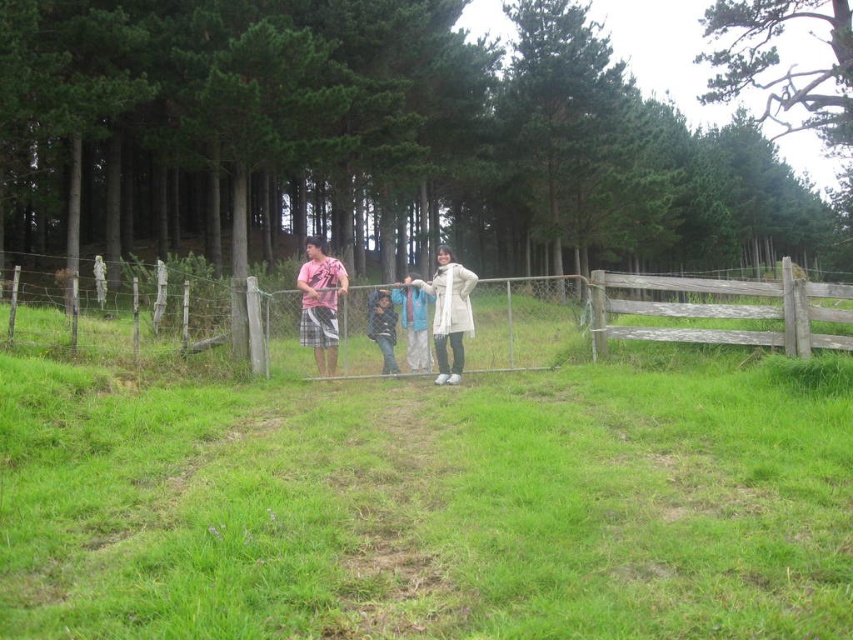
Question: Which of these objects is positioned farthest from the matte pink shirt at center?

Choices:
 (A) weathered wood fence at right
 (B) pink cotton shirt at center

Answer: (A)

Question: Among these objects, which one is farthest from the camera?

Choices:
 (A) pink cotton shirt at center
 (B) weathered wood fence at right
 (C) matte pink shirt at center

Answer: (A)

Question: Does wooden gate at center lie behind matte pink shirt at center?

Choices:
 (A) yes
 (B) no

Answer: (B)

Question: Does wooden gate at center appear on the left side of matte pink shirt at center?

Choices:
 (A) no
 (B) yes

Answer: (B)

Question: Is weathered wood fence at right behind pink cotton shirt at center?

Choices:
 (A) no
 (B) yes

Answer: (A)

Question: Which point is closer to the camera taking this photo?

Choices:
 (A) (334, 360)
 (B) (595, 301)
 (C) (445, 349)

Answer: (C)